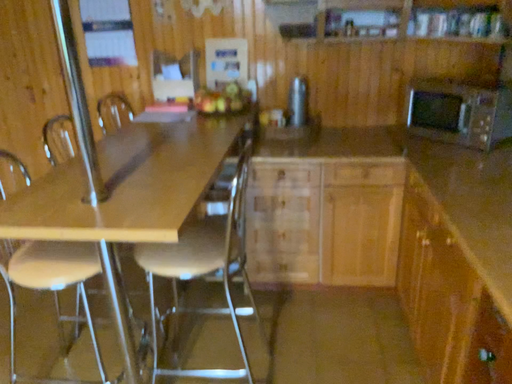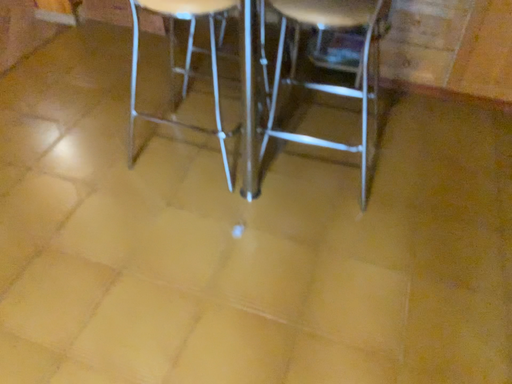
Question: Which way did the camera rotate in the video?

Choices:
 (A) rotated left
 (B) rotated right

Answer: (A)